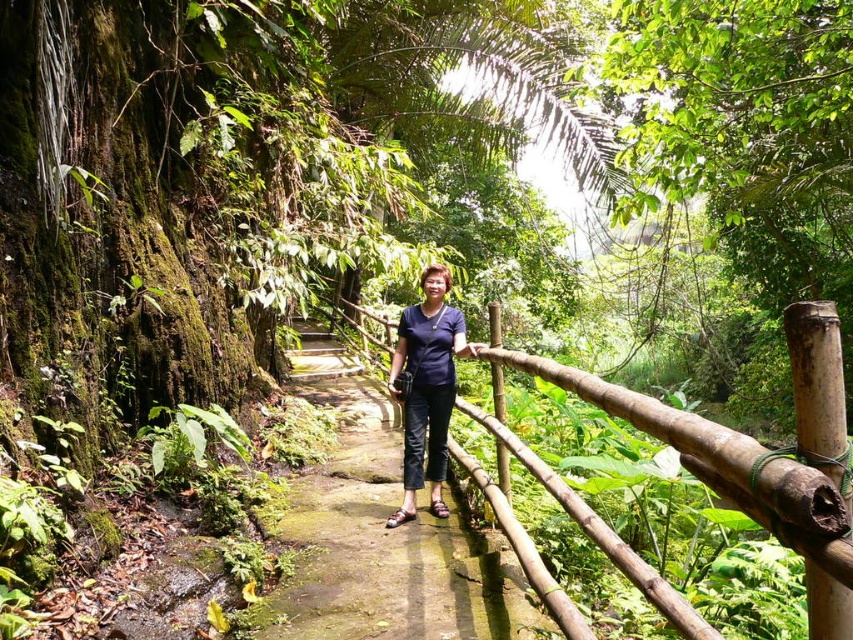
Is brown bamboo rail at center closer to the viewer compared to blue fabric shirt at center?

Result: Yes, it is in front of blue fabric shirt at center.

Find the location of `brown bamboo rail at center`. brown bamboo rail at center is located at coordinates (718, 464).

Does point (807, 566) come closer to viewer compared to point (444, 474)?

Yes, it is.

Find the location of a particular element. The image size is (853, 640). brown bamboo rail at center is located at coordinates (718, 464).

Where is `green mossy stone path at center`? green mossy stone path at center is located at coordinates (387, 545).

Does green mossy stone path at center appear on the right side of blue fabric shirt at center?

No, green mossy stone path at center is not to the right of blue fabric shirt at center.

Is point (436, 628) farther from viewer compared to point (433, 296)?

No, (436, 628) is closer to viewer.

Identify the location of green mossy stone path at center. This screenshot has height=640, width=853. (387, 545).

Consider the image. Does green mossy stone path at center have a greater height compared to brown bamboo rail at center?

No.

Is the position of green mossy stone path at center less distant than that of brown bamboo rail at center?

No, green mossy stone path at center is further to the viewer.

At what (x,y) coordinates should I click in order to perform the action: click on green mossy stone path at center. Please return your answer as a coordinate pair (x, y). The height and width of the screenshot is (640, 853). Looking at the image, I should click on (387, 545).